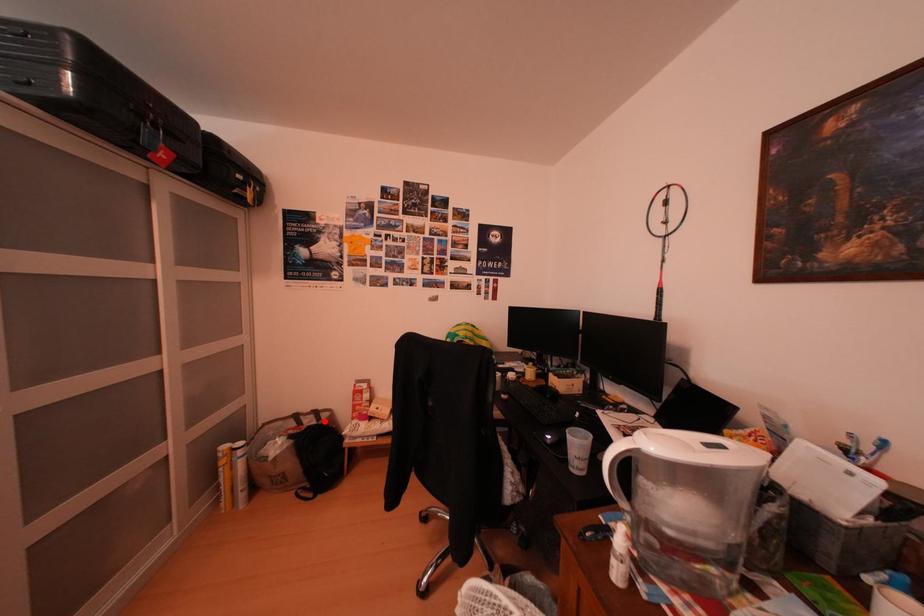
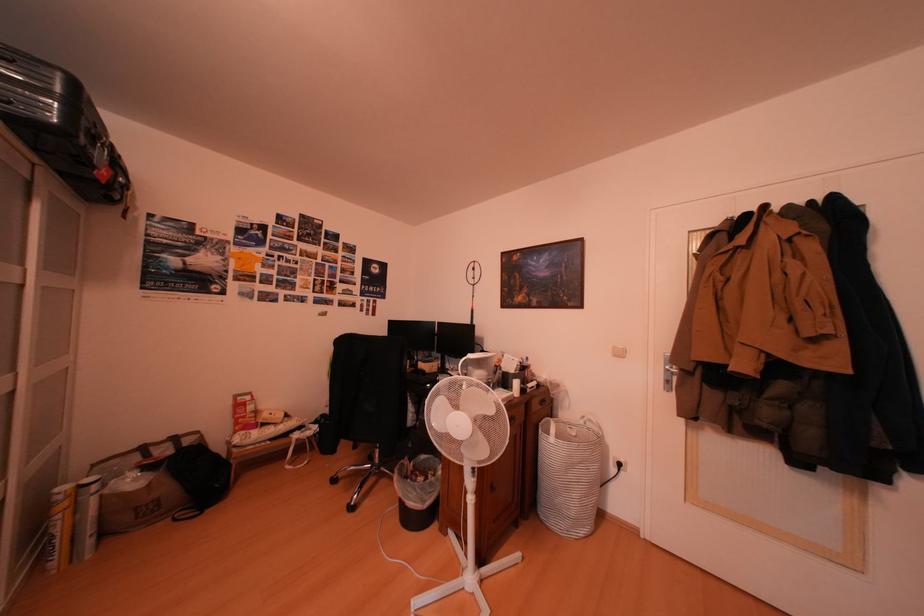
In the second image, find the point that corresponds to the highlighted location in the first image.

(180, 450)